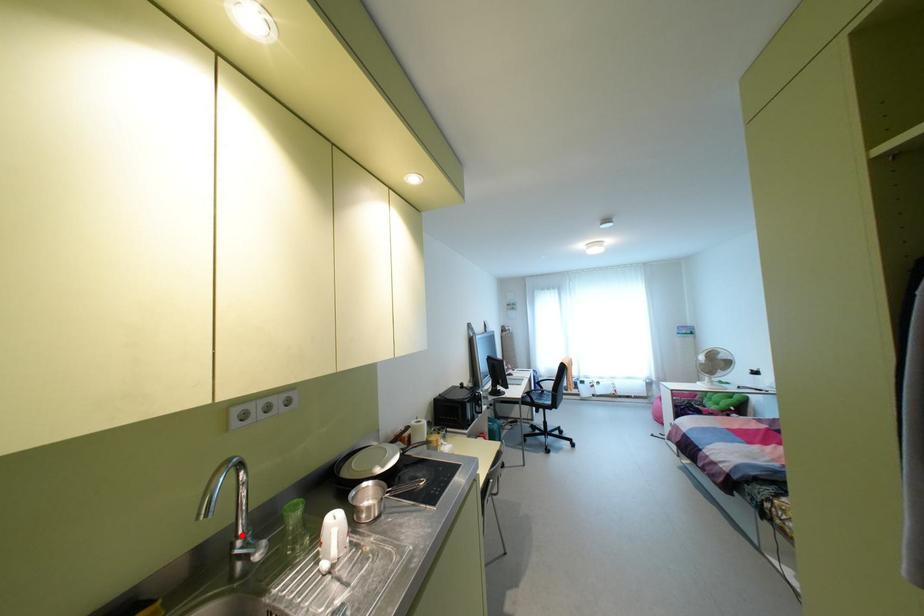
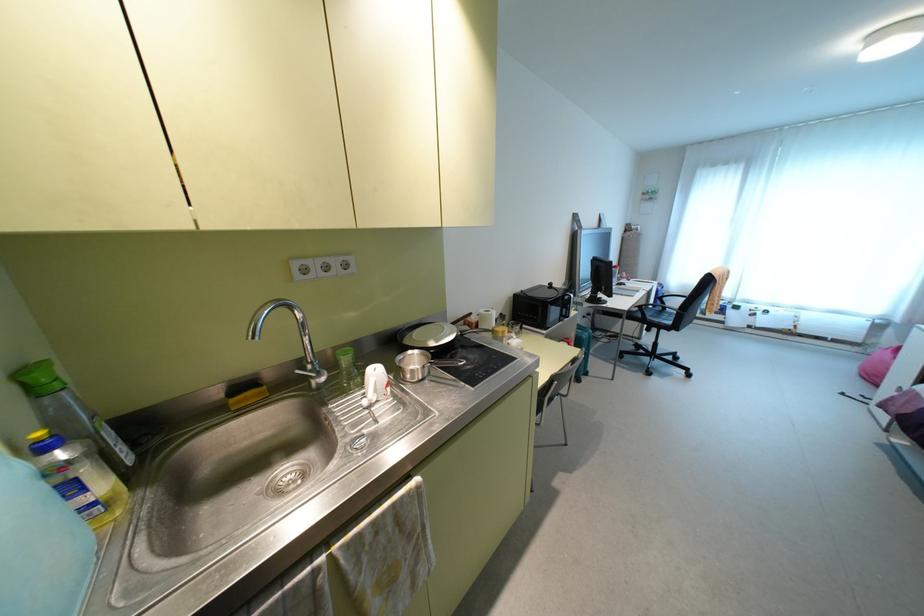
The point at the highlighted location is marked in the first image. Where is the corresponding point in the second image?

(310, 362)